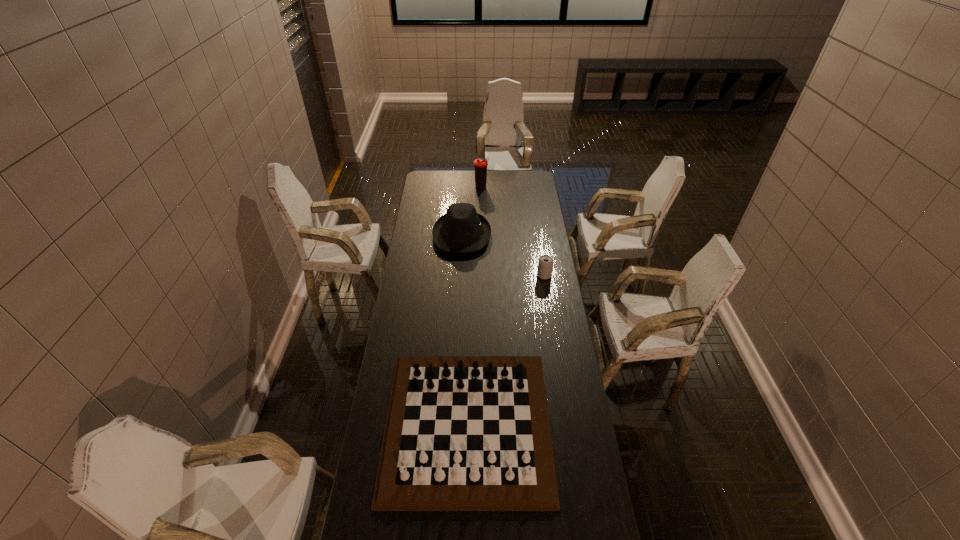
Locate an element on the screen. The width and height of the screenshot is (960, 540). vacant space located 0.400m on the back of the nearest object is located at coordinates (470, 289).

Locate an element on the screen. object located at the far edge is located at coordinates (480, 164).

Find the location of a particular element. fedora at the left edge is located at coordinates (462, 229).

Locate an element on the screen. The width and height of the screenshot is (960, 540). gameboard that is positioned at the left edge is located at coordinates (463, 433).

Find the location of a particular element. can at the right edge is located at coordinates (545, 264).

Image resolution: width=960 pixels, height=540 pixels. Identify the location of gameboard situated at the right edge. (463, 433).

This screenshot has width=960, height=540. In the image, there is a desktop. Identify the location of vacant space at the far edge. (451, 184).

Identify the location of vacant space at the left edge. (427, 262).

Image resolution: width=960 pixels, height=540 pixels. In order to click on free spot at the right edge of the desktop in this screenshot , I will do `click(539, 325)`.

Locate an element on the screen. This screenshot has height=540, width=960. vacant space that's between the can and the gameboard is located at coordinates (506, 350).